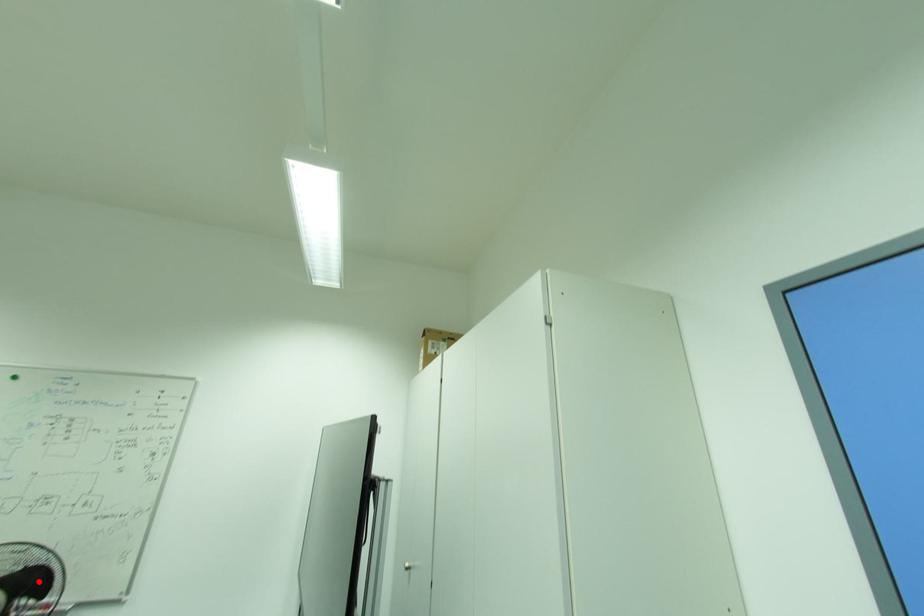
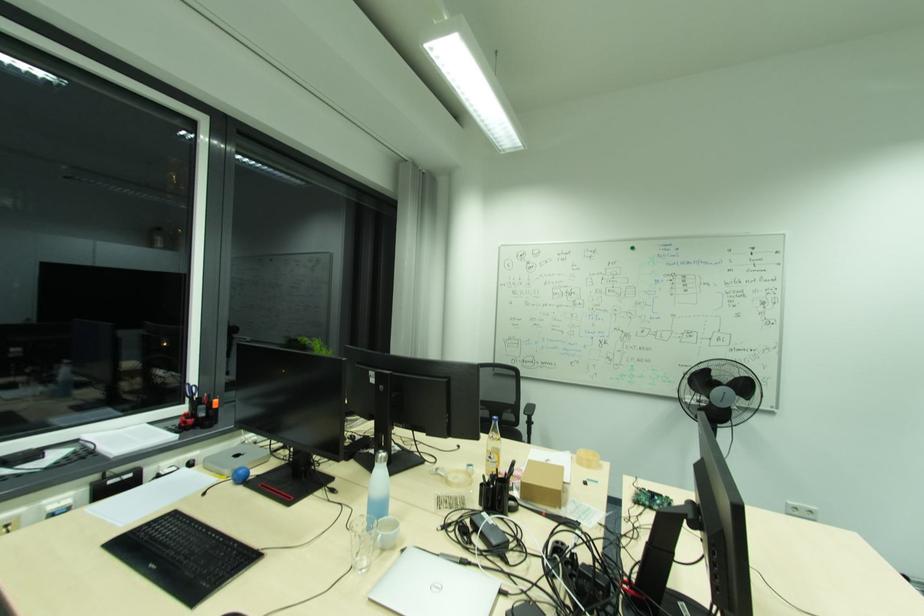
Question: I am providing you with two images of the same scene from different viewpoints. A red point is marked on the first image. Is the red point's position out of view in image 2?

Choices:
 (A) Yes
 (B) No

Answer: (B)